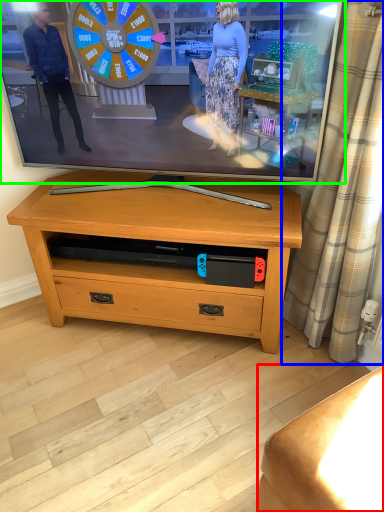
Question: Considering the real-world distances, which object is closest to furniture (highlighted by a red box)? curtain (highlighted by a blue box) or television (highlighted by a green box).

Choices:
 (A) curtain
 (B) television

Answer: (A)